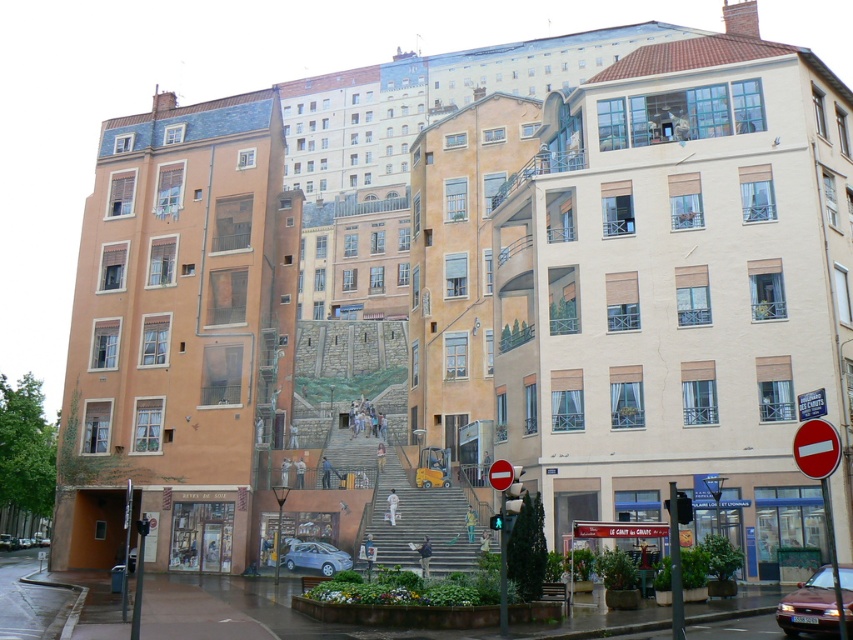
Question: Which object is farther from the camera taking this photo?

Choices:
 (A) red plastic sign at center right
 (B) silver metallic hatchback at center
 (C) red plastic sign at center

Answer: (B)

Question: Does red plastic sign at right come in front of silver metallic hatchback at center?

Choices:
 (A) yes
 (B) no

Answer: (A)

Question: Where is yellow plastic stairs at center located in relation to red plastic sign at center right in the image?

Choices:
 (A) above
 (B) below

Answer: (B)

Question: Which point is farther to the camera?

Choices:
 (A) (833, 452)
 (B) (451, 561)

Answer: (B)

Question: Estimate the real-world distances between objects in this image. Which object is closer to the red plastic sign at center right?

Choices:
 (A) metallic red car at lower right
 (B) yellow plastic stairs at center
 (C) red plastic sign at right
 (D) red plastic sign at center

Answer: (A)

Question: Does red plastic sign at right have a larger size compared to silver metallic hatchback at center?

Choices:
 (A) no
 (B) yes

Answer: (B)